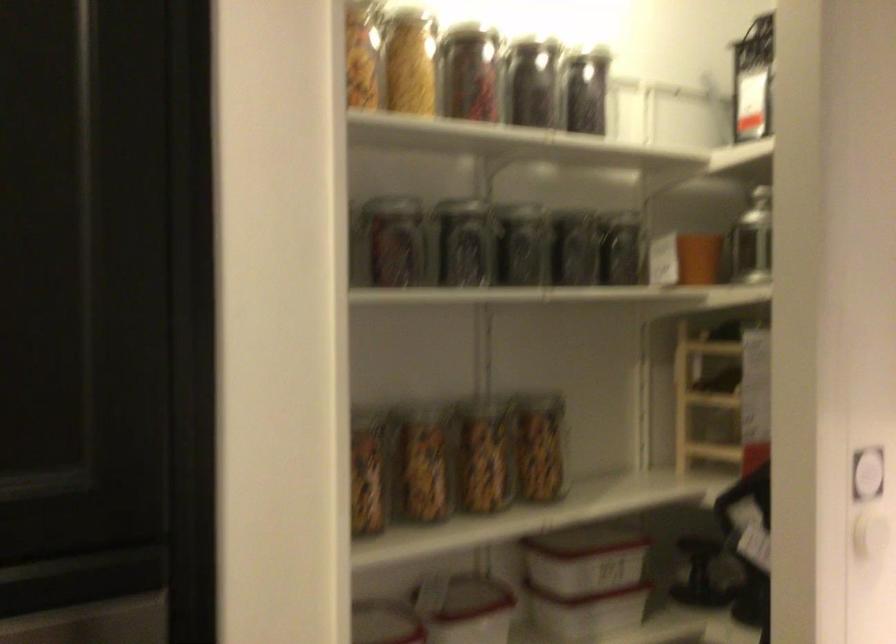
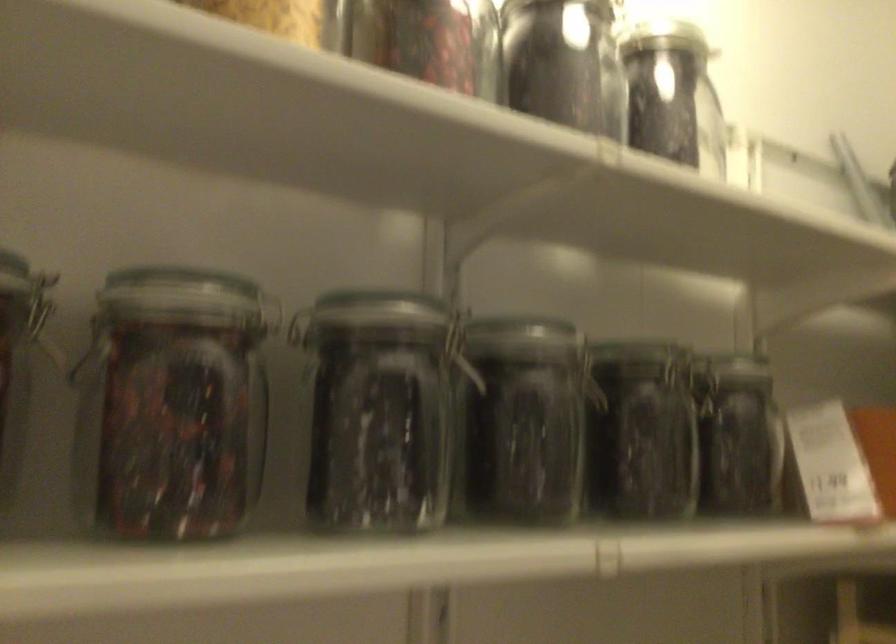
The point at (538, 87) is marked in the first image. Where is the corresponding point in the second image?

(564, 64)